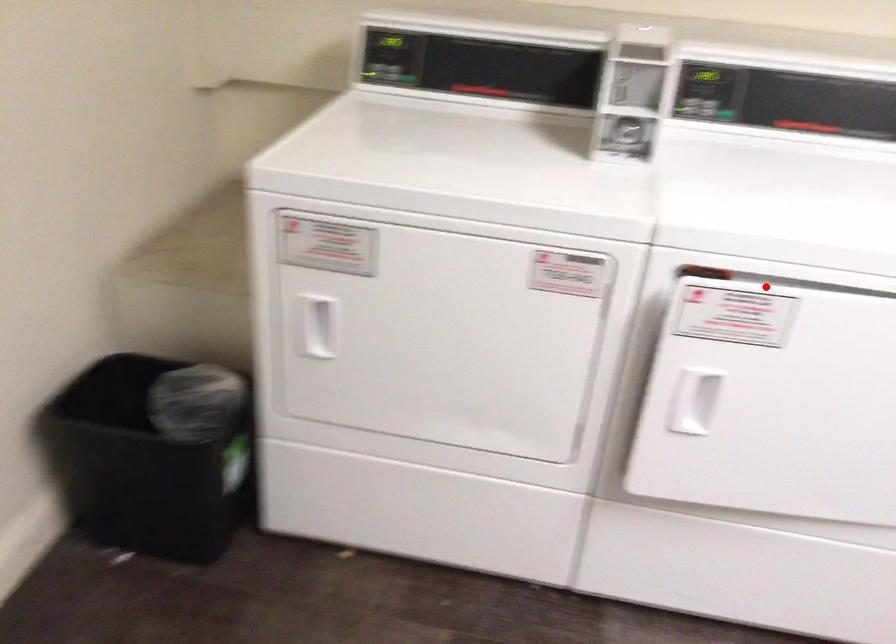
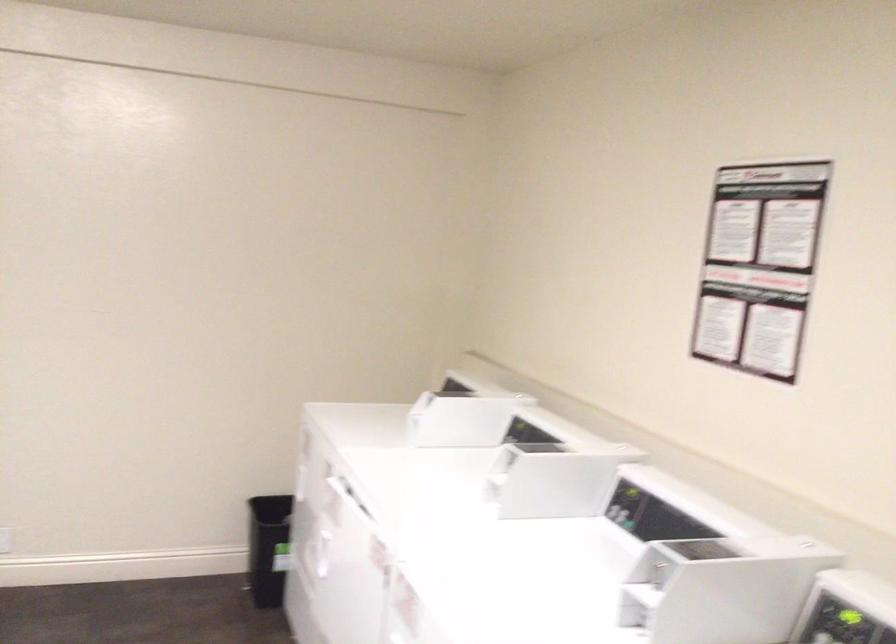
In the second image, find the point that corresponds to the highlighted location in the first image.

(348, 494)